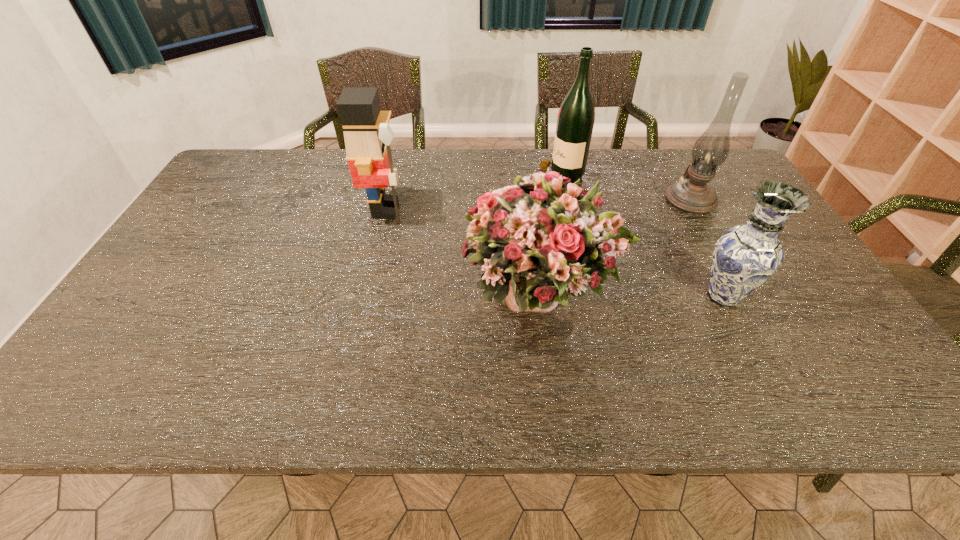
This screenshot has height=540, width=960. I want to click on free space that satisfies the following two spatial constraints: 1. on the back side of the vase; 2. in front of the nutcracker holding the staff, so click(x=679, y=210).